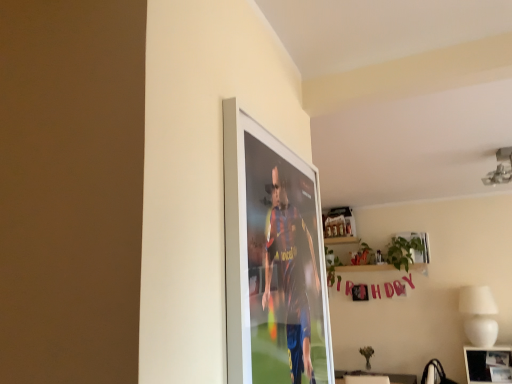
This screenshot has width=512, height=384. What are the coordinates of `white ceramic lamp at lower right` in the screenshot? It's located at pos(479,315).

The width and height of the screenshot is (512, 384). What do you see at coordinates (488, 365) in the screenshot?
I see `metallic silver photo frame at lower right, positioned as the first picture frame in front-to-back order` at bounding box center [488, 365].

Where is `metallic silver photo frame at lower right, which ranks as the 2th picture frame in left-to-right order`? The image size is (512, 384). metallic silver photo frame at lower right, which ranks as the 2th picture frame in left-to-right order is located at coordinates (488, 365).

Find the location of `metallic silver picture frame at upper right, the second picture frame positioned from the front`. metallic silver picture frame at upper right, the second picture frame positioned from the front is located at coordinates (417, 245).

Find the location of `green leafy plant at upper center`. green leafy plant at upper center is located at coordinates (384, 257).

This screenshot has height=384, width=512. What are the coordinates of `white ceramic lamp at lower right` in the screenshot? It's located at (479, 315).

What's the angular difference between green leafy plant at upper center and white ceramic lamp at lower right's facing directions?

The angular difference between green leafy plant at upper center and white ceramic lamp at lower right is 0.831 degrees.

How much distance is there between green leafy plant at upper center and white ceramic lamp at lower right?

green leafy plant at upper center and white ceramic lamp at lower right are 30.63 inches apart from each other.

Which is more to the right, green leafy plant at upper center or white ceramic lamp at lower right?

From the viewer's perspective, white ceramic lamp at lower right appears more on the right side.

Considering the relative sizes of green leafy plant at upper center and white ceramic lamp at lower right in the image provided, is green leafy plant at upper center shorter than white ceramic lamp at lower right?

Incorrect, the height of green leafy plant at upper center does not fall short of that of white ceramic lamp at lower right.

Who is taller, white ceramic lamp at lower right or green leafy plant at upper center?

With more height is green leafy plant at upper center.

This screenshot has width=512, height=384. In order to click on houseplant above the white ceramic lamp at lower right (from the image's perspective) in this screenshot , I will do `click(384, 257)`.

How distant is white ceramic lamp at lower right from green leafy plant at upper center?

white ceramic lamp at lower right and green leafy plant at upper center are 77.81 centimeters apart from each other.

Which object is closer to the camera taking this photo, white ceramic lamp at lower right or green leafy plant at upper center?

white ceramic lamp at lower right is in front.

Which object is closer to the camera taking this photo, metallic silver picture frame at upper right, which is counted as the 2th picture frame, starting from the bottom, or green leafy plant at upper center?

Positioned in front is green leafy plant at upper center.

Is metallic silver picture frame at upper right, the second picture frame positioned from the front, oriented towards green leafy plant at upper center?

Yes, metallic silver picture frame at upper right, the second picture frame positioned from the front, is aimed at green leafy plant at upper center.

Based on the photo, considering the relative sizes of metallic silver picture frame at upper right, which is counted as the 2th picture frame, starting from the bottom, and green leafy plant at upper center in the image provided, is metallic silver picture frame at upper right, which is counted as the 2th picture frame, starting from the bottom, wider than green leafy plant at upper center?

Yes, metallic silver picture frame at upper right, which is counted as the 2th picture frame, starting from the bottom, is wider than green leafy plant at upper center.

Does point (423, 244) come farther from viewer compared to point (398, 250)?

That is False.

Choose the correct answer: Is metallic silver photo frame at lower right, the 2th picture frame in the back-to-front sequence, inside metallic silver picture frame at upper right, which is counted as the 2th picture frame, starting from the bottom, or outside it?

metallic silver photo frame at lower right, the 2th picture frame in the back-to-front sequence, is not inside metallic silver picture frame at upper right, which is counted as the 2th picture frame, starting from the bottom, it's outside.

How different are the orientations of metallic silver photo frame at lower right, positioned as the first picture frame in front-to-back order, and metallic silver picture frame at upper right, which is the first picture frame in left-to-right order, in degrees?

0.977 degrees.

Between metallic silver photo frame at lower right, which is the 1th picture frame from right to left, and metallic silver picture frame at upper right, positioned as the first picture frame in back-to-front order, which one has smaller width?

metallic silver picture frame at upper right, positioned as the first picture frame in back-to-front order.

Does metallic silver photo frame at lower right, which is the 1th picture frame from right to left, have a greater height compared to metallic silver picture frame at upper right, the second picture frame from the right?

Indeed, metallic silver photo frame at lower right, which is the 1th picture frame from right to left, has a greater height compared to metallic silver picture frame at upper right, the second picture frame from the right.

Considering the sizes of objects green leafy plant at upper center and metallic silver photo frame at lower right, which ranks as the 2th picture frame in left-to-right order, in the image provided, who is taller, green leafy plant at upper center or metallic silver photo frame at lower right, which ranks as the 2th picture frame in left-to-right order,?

green leafy plant at upper center.

From the picture: Are green leafy plant at upper center and metallic silver photo frame at lower right, the first picture frame ordered from the bottom, making contact?

No, green leafy plant at upper center is not next to metallic silver photo frame at lower right, the first picture frame ordered from the bottom.

Does point (330, 281) lie in front of point (497, 375)?

No, (330, 281) is further to viewer.

Between green leafy plant at upper center and metallic silver picture frame at upper right, which is the first picture frame in left-to-right order, which one has larger size?

green leafy plant at upper center is bigger.

Is green leafy plant at upper center wider than metallic silver picture frame at upper right, placed as the 1th picture frame when sorted from top to bottom?

No.

Does point (352, 268) come in front of point (416, 240)?

That is False.

Relative to metallic silver photo frame at lower right, which ranks as the 2th picture frame in left-to-right order, is white ceramic lamp at lower right in front or behind?

In the image, white ceramic lamp at lower right appears behind metallic silver photo frame at lower right, which ranks as the 2th picture frame in left-to-right order.

Is white ceramic lamp at lower right directly adjacent to metallic silver photo frame at lower right, positioned as the first picture frame in front-to-back order?

white ceramic lamp at lower right and metallic silver photo frame at lower right, positioned as the first picture frame in front-to-back order, are clearly separated.

Which of these two, white ceramic lamp at lower right or metallic silver photo frame at lower right, the first picture frame ordered from the bottom, stands shorter?

metallic silver photo frame at lower right, the first picture frame ordered from the bottom, is shorter.

Considering the positions of objects white ceramic lamp at lower right and metallic silver photo frame at lower right, the 2th picture frame when ordered from top to bottom, in the image provided, who is more to the right, white ceramic lamp at lower right or metallic silver photo frame at lower right, the 2th picture frame when ordered from top to bottom,?

metallic silver photo frame at lower right, the 2th picture frame when ordered from top to bottom, is more to the right.

The image size is (512, 384). Identify the location of houseplant above the white ceramic lamp at lower right (from a real-world perspective). (384, 257).

You are a GUI agent. You are given a task and a screenshot of the screen. Output one action in this format:
    pyautogui.click(x=<x>, y=<y>)
    Task: Click on the lamp on the right of green leafy plant at upper center
    Image resolution: width=512 pixels, height=384 pixels.
    Given the screenshot: What is the action you would take?
    pyautogui.click(x=479, y=315)

Based on their spatial positions, is metallic silver picture frame at upper right, the second picture frame from the right, or metallic silver photo frame at lower right, the 2th picture frame when ordered from top to bottom, closer to white ceramic lamp at lower right?

metallic silver photo frame at lower right, the 2th picture frame when ordered from top to bottom, is closer to white ceramic lamp at lower right.

From the image, which object appears to be farther from metallic silver photo frame at lower right, the 2th picture frame in the back-to-front sequence, green leafy plant at upper center or metallic silver picture frame at upper right, placed as the 1th picture frame when sorted from top to bottom?

green leafy plant at upper center is positioned further to the anchor metallic silver photo frame at lower right, the 2th picture frame in the back-to-front sequence.

Based on their spatial positions, is metallic silver picture frame at upper right, placed as the 1th picture frame when sorted from top to bottom, or green leafy plant at upper center closer to white ceramic lamp at lower right?

metallic silver picture frame at upper right, placed as the 1th picture frame when sorted from top to bottom, is closer to white ceramic lamp at lower right.

In the scene shown: Estimate the real-world distances between objects in this image. Which object is further from white ceramic lamp at lower right, metallic silver photo frame at lower right, the 2th picture frame when ordered from top to bottom, or metallic silver picture frame at upper right, the second picture frame from the right?

Among the two, metallic silver picture frame at upper right, the second picture frame from the right, is located further to white ceramic lamp at lower right.

Considering their positions, is metallic silver picture frame at upper right, positioned as the first picture frame in back-to-front order, positioned closer to metallic silver photo frame at lower right, which is the 1th picture frame from right to left, than white ceramic lamp at lower right?

A: white ceramic lamp at lower right is positioned closer to the anchor metallic silver photo frame at lower right, which is the 1th picture frame from right to left.

Based on their spatial positions, is green leafy plant at upper center or white ceramic lamp at lower right further from metallic silver picture frame at upper right, which is counted as the 2th picture frame, starting from the bottom?

Based on the image, white ceramic lamp at lower right appears to be further to metallic silver picture frame at upper right, which is counted as the 2th picture frame, starting from the bottom.

Considering their positions, is metallic silver photo frame at lower right, the first picture frame ordered from the bottom, positioned further to metallic silver picture frame at upper right, the second picture frame positioned from the front, than green leafy plant at upper center?

metallic silver photo frame at lower right, the first picture frame ordered from the bottom.

Based on their spatial positions, is white ceramic lamp at lower right or metallic silver picture frame at upper right, placed as the 1th picture frame when sorted from top to bottom, further from green leafy plant at upper center?

white ceramic lamp at lower right lies further to green leafy plant at upper center than the other object.

Locate an element on the screen. lamp located between green leafy plant at upper center and metallic silver photo frame at lower right, which ranks as the 2th picture frame in left-to-right order, in the left-right direction is located at coordinates (479, 315).

At what (x,y) coordinates should I click in order to perform the action: click on houseplant between metallic silver picture frame at upper right, which is the first picture frame in left-to-right order, and metallic silver photo frame at lower right, the 2th picture frame in the back-to-front sequence, from top to bottom. Please return your answer as a coordinate pair (x, y). This screenshot has height=384, width=512. Looking at the image, I should click on (384, 257).

You are a GUI agent. You are given a task and a screenshot of the screen. Output one action in this format:
    pyautogui.click(x=<x>, y=<y>)
    Task: Click on the picture frame between green leafy plant at upper center and white ceramic lamp at lower right from left to right
    
    Given the screenshot: What is the action you would take?
    pyautogui.click(x=417, y=245)

Locate an element on the screen. Image resolution: width=512 pixels, height=384 pixels. lamp between metallic silver picture frame at upper right, placed as the 1th picture frame when sorted from top to bottom, and metallic silver photo frame at lower right, which ranks as the 2th picture frame in left-to-right order, in the up-down direction is located at coordinates (479, 315).